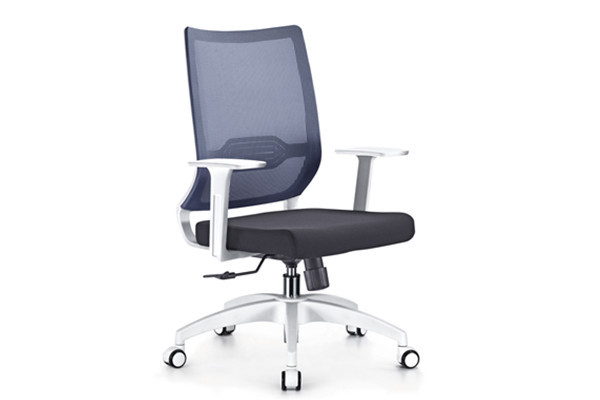
Image resolution: width=600 pixels, height=400 pixels. I want to click on 2 arm rests, so click(x=217, y=165), click(x=370, y=150).